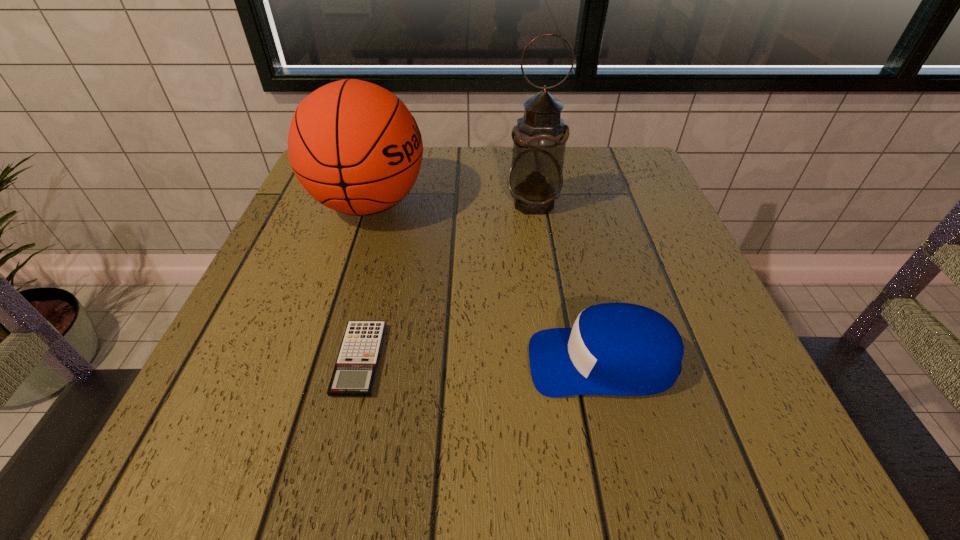
Find the location of a particular element. This screenshot has width=960, height=540. oil lamp is located at coordinates (535, 179).

The image size is (960, 540). I want to click on basketball, so [x=354, y=146].

The height and width of the screenshot is (540, 960). I want to click on the second shortest object, so click(x=621, y=349).

The image size is (960, 540). Identify the location of the shortest object. (354, 374).

Identify the location of vacant region located 0.130m on the left of the oil lamp. Image resolution: width=960 pixels, height=540 pixels. (446, 203).

I want to click on vacant region located 0.190m on the side with logo of the third shortest object, so click(x=516, y=204).

The height and width of the screenshot is (540, 960). I want to click on free space located 0.400m on the front-facing side of the second shortest object, so click(x=260, y=362).

You are a GUI agent. You are given a task and a screenshot of the screen. Output one action in this format:
    pyautogui.click(x=<x>, y=<y>)
    Task: Click on the vacant point located on the front-facing side of the second shortest object
    Image resolution: width=960 pixels, height=540 pixels.
    Given the screenshot: What is the action you would take?
    pyautogui.click(x=415, y=362)

At what (x,y) coordinates should I click in order to perform the action: click on vacant region located 0.160m on the front-facing side of the second shortest object. Please return your answer as a coordinate pair (x, y). Looking at the image, I should click on pyautogui.click(x=421, y=362).

Locate an element on the screen. This screenshot has height=540, width=960. vacant space positioned 0.310m on the right of the shortest object is located at coordinates (588, 359).